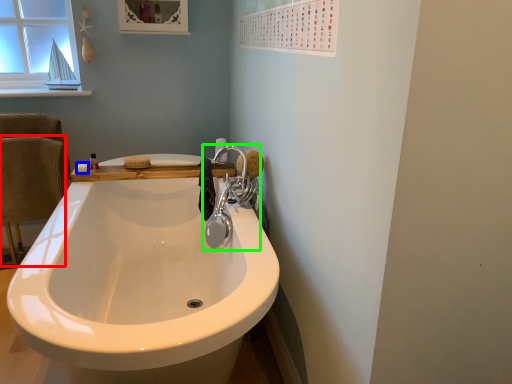
Question: Which is farther away from armchair (highlighted by a red box)? soap (highlighted by a blue box) or tap (highlighted by a green box)?

Choices:
 (A) soap
 (B) tap

Answer: (B)